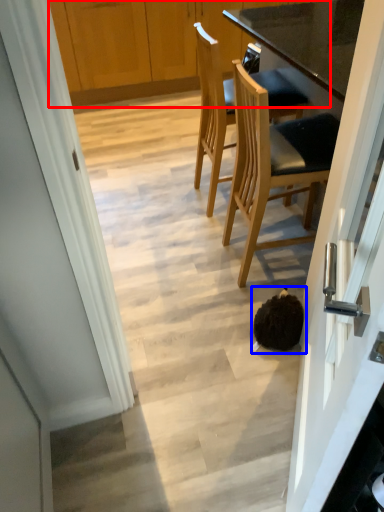
Question: Which point is further to the camera, cabinetry (highlighted by a red box) or head (highlighted by a blue box)?

Choices:
 (A) cabinetry
 (B) head

Answer: (A)